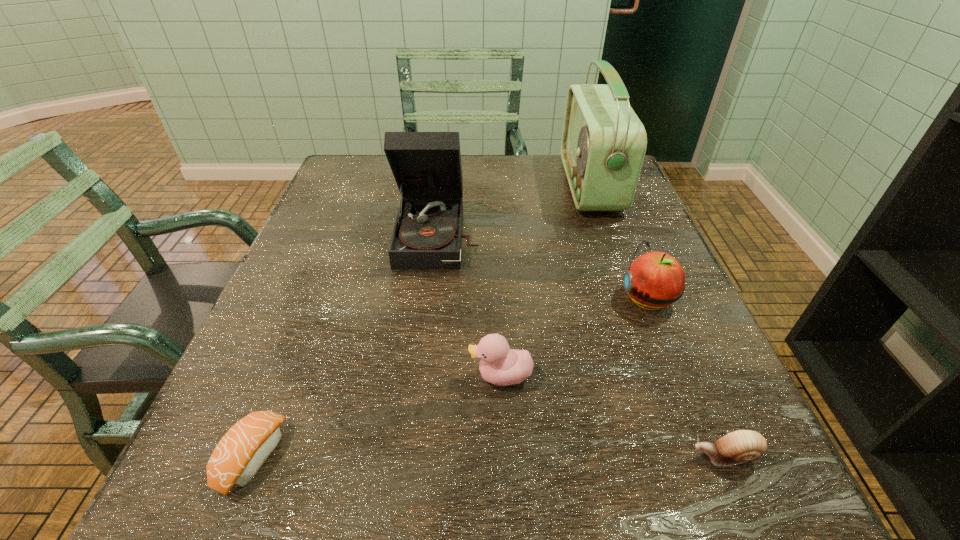
This screenshot has height=540, width=960. Identify the location of free space that satisfies the following two spatial constraints: 1. on the front panel of the tallest object; 2. on the front-facing side of the phonograph_record. (608, 235).

Where is `blank area in the image that satisfies the following two spatial constraints: 1. on the front-facing side of the fourth nearest object; 2. on the left side of the phonograph_record`? blank area in the image that satisfies the following two spatial constraints: 1. on the front-facing side of the fourth nearest object; 2. on the left side of the phonograph_record is located at coordinates (432, 298).